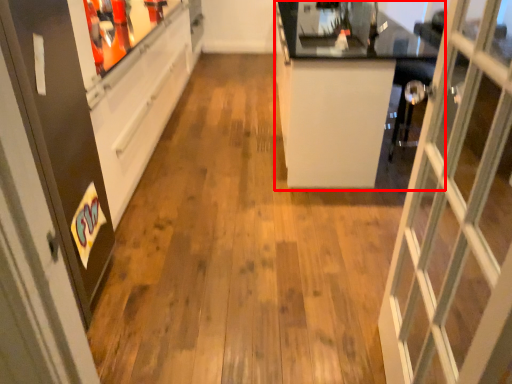
Question: Where is counter (annotated by the red box) located in relation to screen door in the image?

Choices:
 (A) left
 (B) right

Answer: (B)